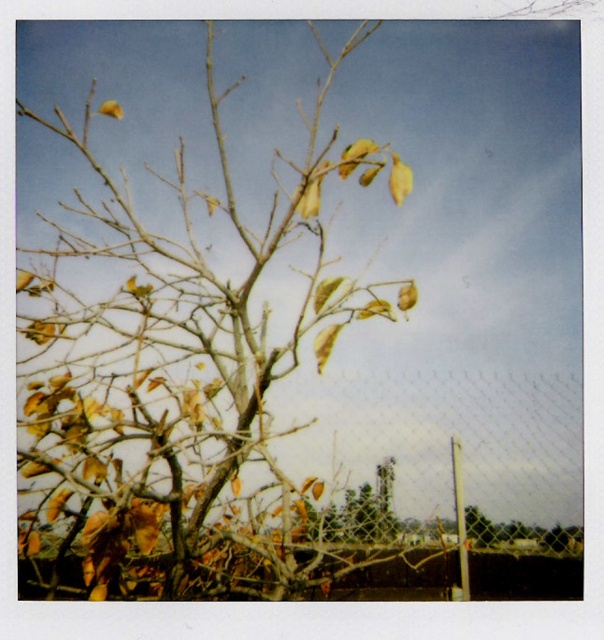
You are standing in front of the tree with sparse dry branches. There is a point marked at coordinates (185, 376). What does this point indicate?

The point at coordinates (185, 376) marks the location of the brown dry branch at center.

You are a bird looking for a place to perch. You see a brown dry branch at center and a green matte tree at center. Which one is above the other?

The brown dry branch at center is positioned over the green matte tree at center, so it is above.